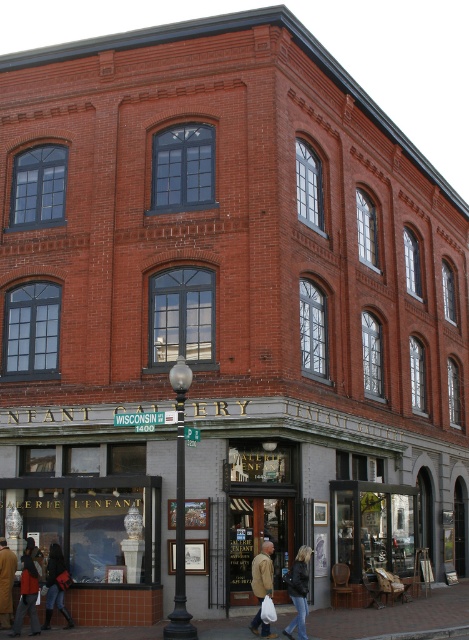
You are standing in front of the building on Wisconsin Ave. You notice two points marked on the building. One is at coordinate point (x=375, y=620) and the other is at point (x=21, y=621). Which point is closer to you?

Point (x=21, y=621) is closer to you because it is nearer to the camera compared to point (x=375, y=620).

You are a delivery person trying to secure a package on a 1.5 meter tall cart. You need to place the cart between the black metal pole at center and the denim jacket at lower left. Is there enough vertical space between them for the cart?

The black metal pole at center is taller than the denim jacket at lower left. Since the cart is 1.5 meters tall, the vertical space between them should accommodate it as long as the lower object, the denim jacket at lower left, doesn

You are a customer browsing the storefront of L Enfant Gallery on Wisconsin Ave. You see a matte red coat at lower left and a denim jacket at lower left. Which clothing item is shorter in height?

The matte red coat at lower left is not as tall as the denim jacket at lower left, so the matte red coat at lower left is shorter in height.